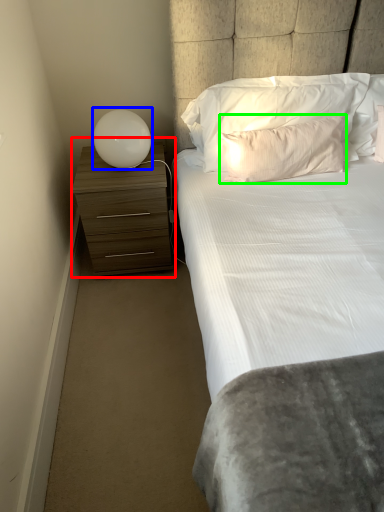
Question: Considering the real-world distances, which object is closest to chest of drawers (highlighted by a red box)? lamp (highlighted by a blue box) or pillow (highlighted by a green box).

Choices:
 (A) lamp
 (B) pillow

Answer: (A)